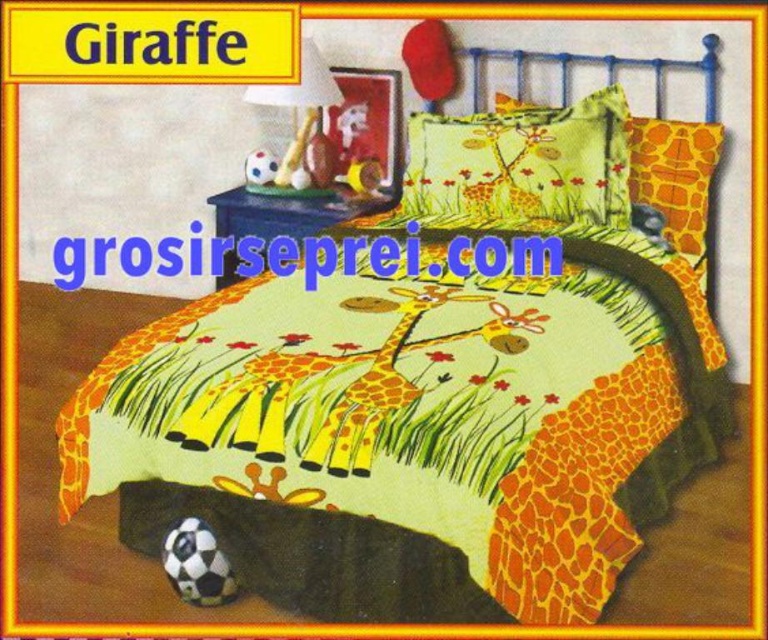
Can you confirm if yellow giraffe-patterned pillow at upper right is positioned to the right of matte plastic lamp at upper center?

Indeed, yellow giraffe-patterned pillow at upper right is positioned on the right side of matte plastic lamp at upper center.

What do you see at coordinates (674, 179) in the screenshot? The image size is (768, 640). I see `yellow giraffe-patterned pillow at upper right` at bounding box center [674, 179].

The image size is (768, 640). In order to click on yellow giraffe-patterned pillow at upper right in this screenshot , I will do `click(674, 179)`.

Where is `yellow giraffe-patterned pillow at upper right`? yellow giraffe-patterned pillow at upper right is located at coordinates (674, 179).

Which is more to the right, matte yellow pillow with giraffe design at center or matte plastic lamp at upper center?

matte yellow pillow with giraffe design at center

Is point (426, 202) in front of point (296, 145)?

Yes, point (426, 202) is closer to viewer.

Locate an element on the screen. The width and height of the screenshot is (768, 640). matte yellow pillow with giraffe design at center is located at coordinates (522, 163).

You are a GUI agent. You are given a task and a screenshot of the screen. Output one action in this format:
    pyautogui.click(x=<x>, y=<y>)
    Task: Click on the matte yellow pillow with giraffe design at center
    
    Given the screenshot: What is the action you would take?
    pyautogui.click(x=522, y=163)

Does matte yellow pillow with giraffe design at center appear on the right side of yellow giraffe-patterned pillow at upper right?

In fact, matte yellow pillow with giraffe design at center is to the left of yellow giraffe-patterned pillow at upper right.

Does matte yellow pillow with giraffe design at center have a lesser width compared to yellow giraffe-patterned pillow at upper right?

No, matte yellow pillow with giraffe design at center is not thinner than yellow giraffe-patterned pillow at upper right.

Identify the location of matte yellow pillow with giraffe design at center. Image resolution: width=768 pixels, height=640 pixels. (522, 163).